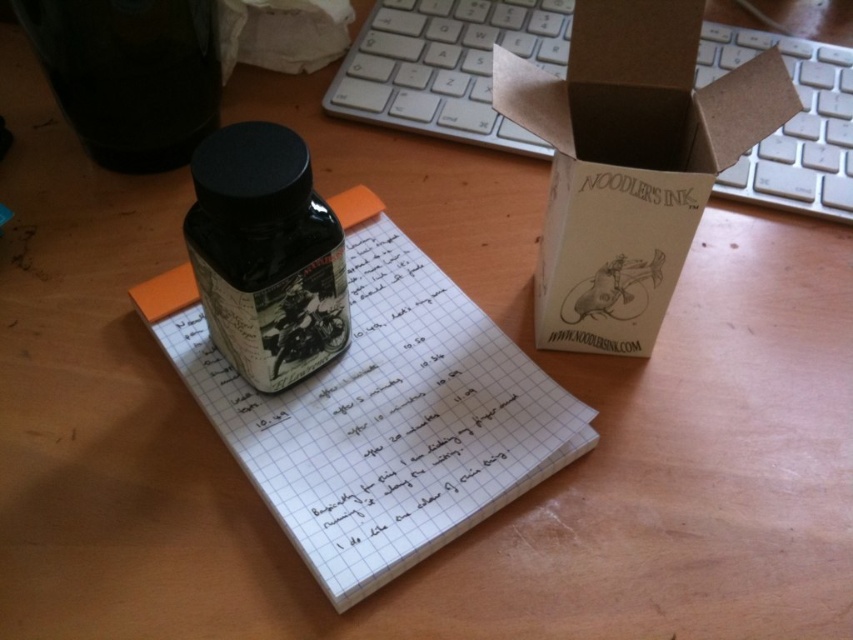
Does point (294, 193) come farther from viewer compared to point (259, 40)?

No.

Does matte glass bottle at center have a lesser width compared to white paper at upper center?

Yes.

This screenshot has height=640, width=853. Identify the location of matte glass bottle at center. (265, 253).

Locate an element on the screen. matte glass bottle at center is located at coordinates (265, 253).

Does white plastic keyboard at upper center lie in front of matte black bottle at upper left?

No, it is not.

In the scene shown: Which is more to the left, white plastic keyboard at upper center or matte black bottle at upper left?

Positioned to the left is matte black bottle at upper left.

Who is more distant from viewer, (848, 102) or (177, 56)?

The point (848, 102) is more distant.

This screenshot has width=853, height=640. Identify the location of white plastic keyboard at upper center. (447, 67).

Who is lower down, brown cardboard box at center or white paper at upper center?

Positioned lower is brown cardboard box at center.

Can you confirm if brown cardboard box at center is taller than white paper at upper center?

Yes, brown cardboard box at center is taller than white paper at upper center.

Is point (637, 292) positioned in front of point (291, 72)?

Yes.

Identify the location of brown cardboard box at center. Image resolution: width=853 pixels, height=640 pixels. point(630,163).